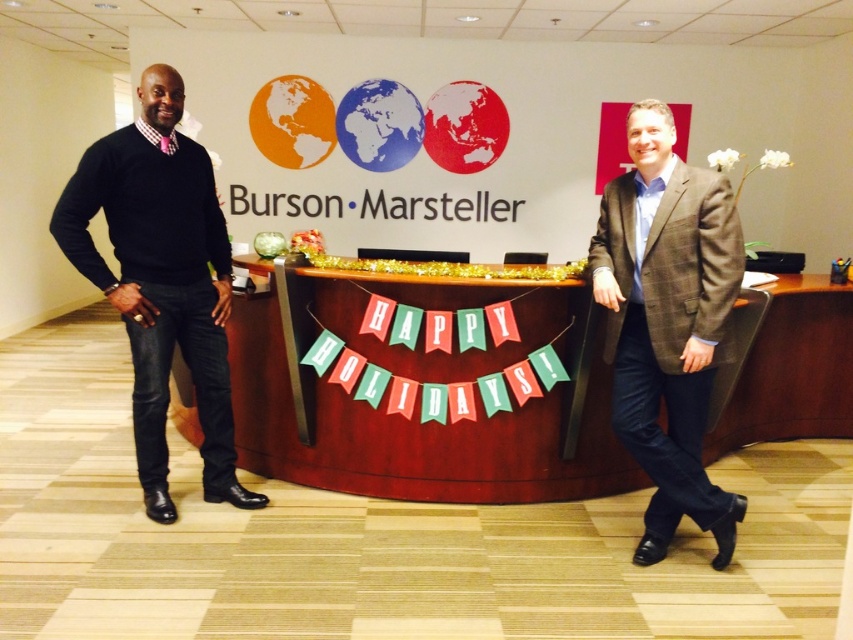
Question: Does brown plaid blazer at center have a greater width compared to black sweater at left?

Choices:
 (A) no
 (B) yes

Answer: (A)

Question: Which object is farther from the camera taking this photo?

Choices:
 (A) brown plaid blazer at center
 (B) red wood desk at center

Answer: (B)

Question: Can you confirm if red wood desk at center is smaller than brown plaid blazer at center?

Choices:
 (A) no
 (B) yes

Answer: (A)

Question: Estimate the real-world distances between objects in this image. Which object is farther from the brown plaid blazer at center?

Choices:
 (A) red wood desk at center
 (B) black sweater at left

Answer: (B)

Question: Does red wood desk at center come behind black sweater at left?

Choices:
 (A) yes
 (B) no

Answer: (A)

Question: Which object is the closest to the brown plaid blazer at center?

Choices:
 (A) red wood desk at center
 (B) black sweater at left

Answer: (A)